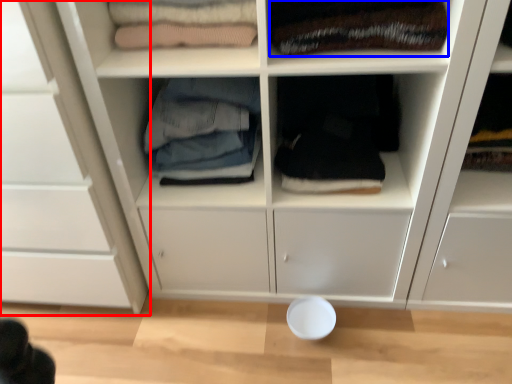
Question: Which of the following is the closest to the observer, cupboard (highlighted by a red box) or clothing (highlighted by a blue box)?

Choices:
 (A) cupboard
 (B) clothing

Answer: (A)